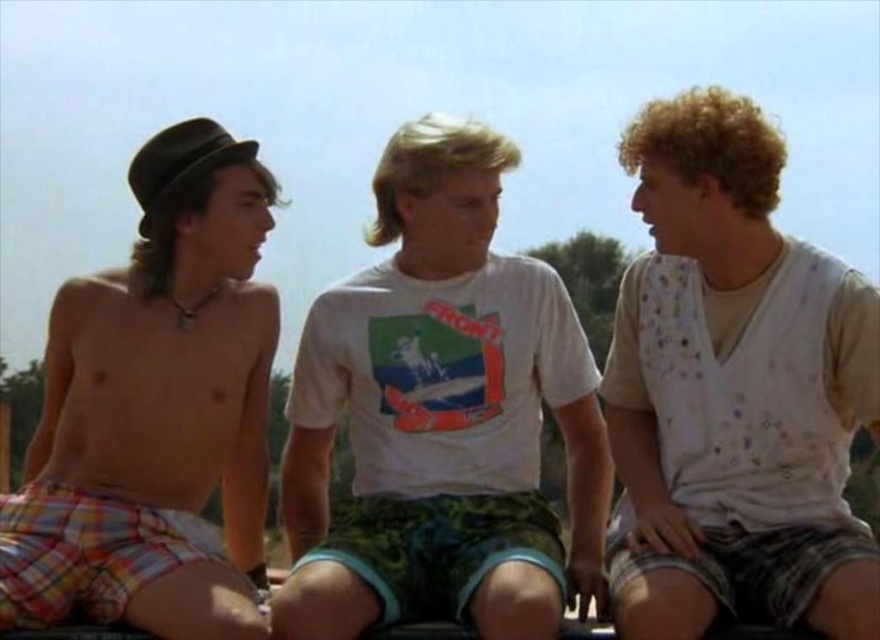
Based on the scene description, can you determine the spatial relationship between the white dotted shirt at right and the plaid shorts at left? Specifically, which one is positioned higher in the image?

The white dotted shirt at right is located above the plaid shorts at left, meaning it is positioned higher in the image.